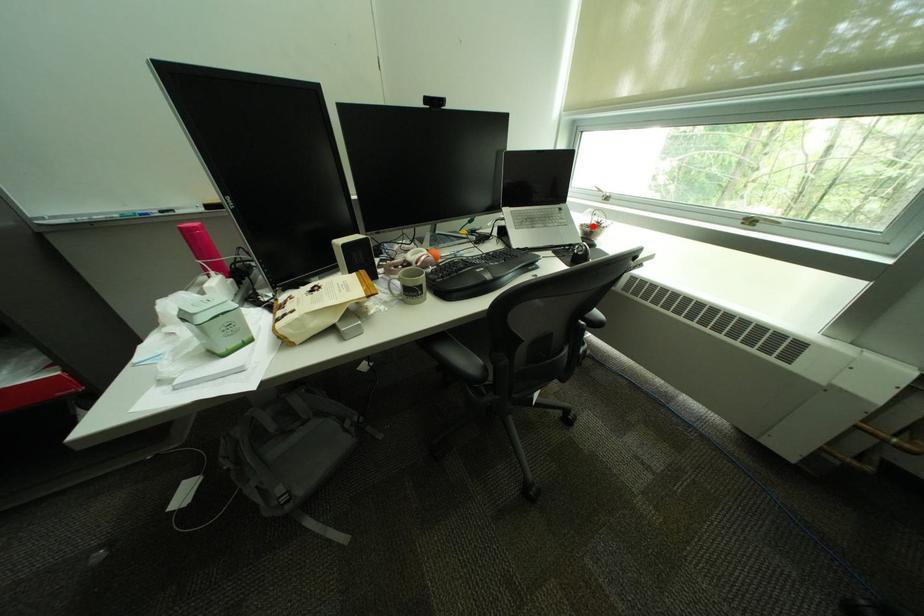
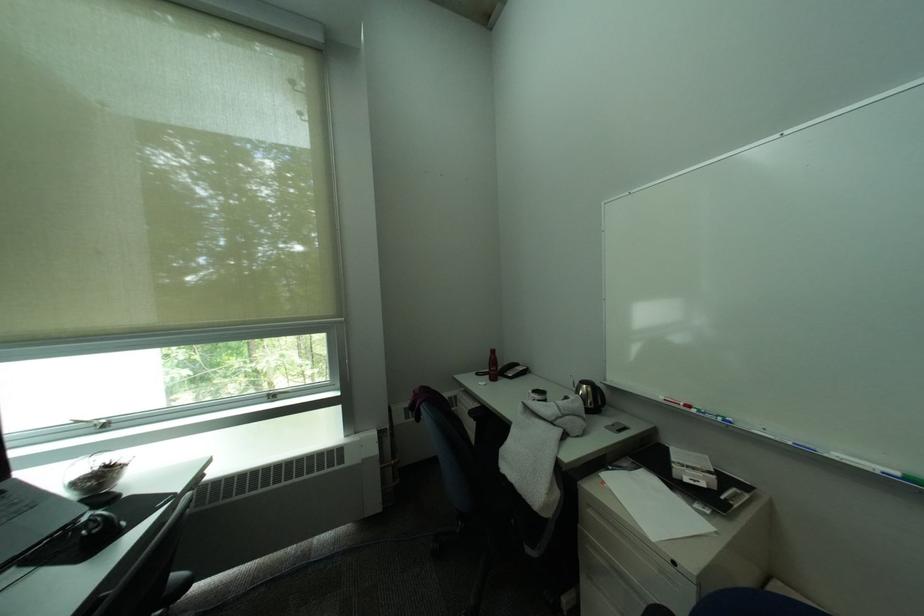
Locate, in the second image, the point that corresponds to the highlighted location in the first image.

(84, 485)